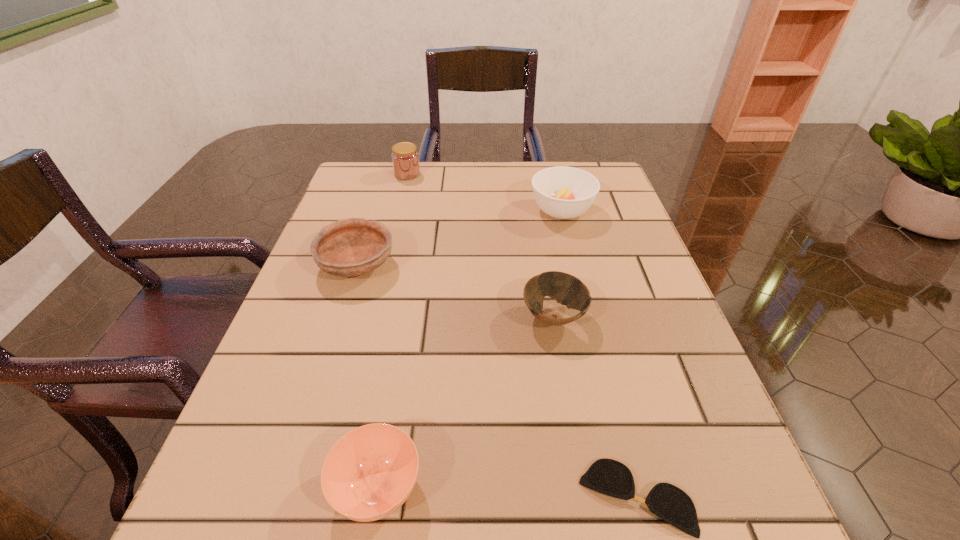
Locate an element on the screen. jam at the left edge is located at coordinates (405, 158).

I want to click on bowl present at the left edge, so click(349, 247).

This screenshot has width=960, height=540. I want to click on soup bowl that is at the right edge, so click(x=562, y=192).

Identify the location of spectacles present at the right edge. The image size is (960, 540). (610, 477).

The height and width of the screenshot is (540, 960). In order to click on object present at the far left corner in this screenshot , I will do `click(405, 158)`.

At what (x,y) coordinates should I click in order to perform the action: click on object present at the far right corner. Please return your answer as a coordinate pair (x, y). The image size is (960, 540). Looking at the image, I should click on (562, 192).

At what (x,y) coordinates should I click in order to perform the action: click on object that is at the near right corner. Please return your answer as a coordinate pair (x, y). Looking at the image, I should click on (610, 477).

At what (x,y) coordinates should I click in order to perform the action: click on vacant space at the far edge of the desktop. Please return your answer as a coordinate pair (x, y). The width and height of the screenshot is (960, 540). Looking at the image, I should click on (426, 195).

Where is `free space at the left edge of the desktop`? This screenshot has height=540, width=960. free space at the left edge of the desktop is located at coordinates (255, 413).

Image resolution: width=960 pixels, height=540 pixels. I want to click on free space at the right edge of the desktop, so click(x=648, y=329).